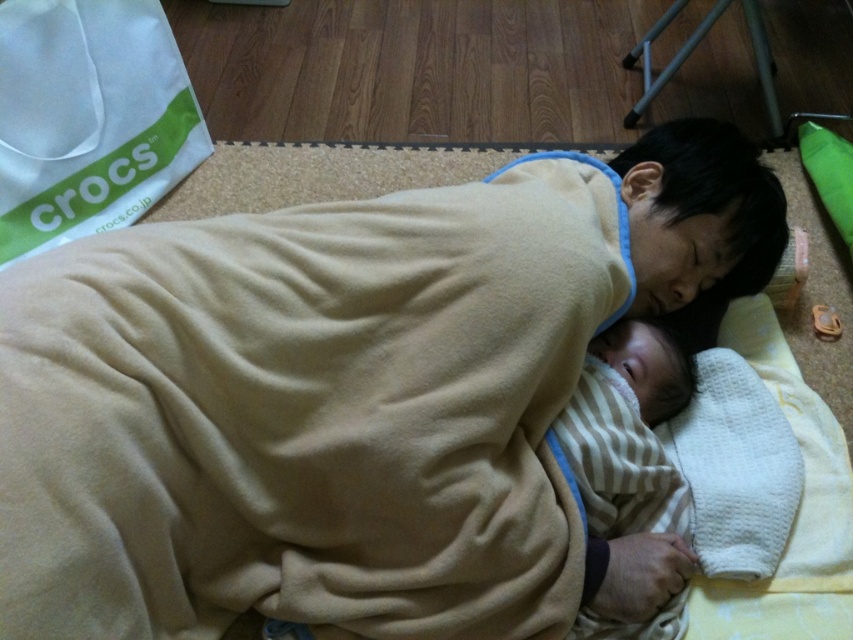
You are a caregiver trying to locate a specific cloth in the room. You see the striped fabric baby at center and the white textured cloth at lower center. Which object is closer to you?

The striped fabric baby at center is closer to you because it is in front of the white textured cloth at lower center.

You are a caregiver who needs to place a striped fabric baby at center onto a white textured cloth at lower center. The cloth is only 4 inches wide. Will the baby fit on the cloth?

The distance between the striped fabric baby at center and the white textured cloth at lower center is 4.59 inches. Since the cloth is only 4 inches wide, the baby will not fit on the cloth.

You are organizing a play area and need to choose between placing the striped fabric baby at center and the white textured cloth at lower center. Which item should you select if you want the larger one for a baby to lie on?

The striped fabric baby at center is bigger than the white textured cloth at lower center, so you should choose the striped fabric baby at center for the baby to lie on.